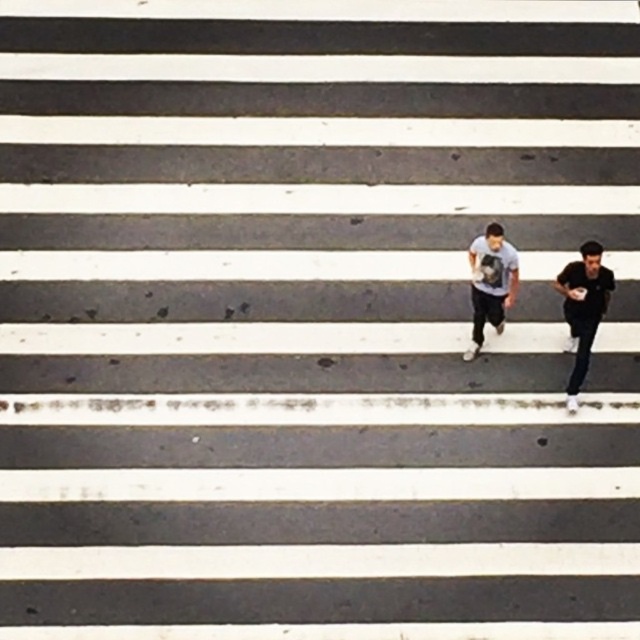
Question: Which object appears closest to the camera in this image?

Choices:
 (A) light blue cotton t-shirt at center
 (B) dark gray fabric pants at right

Answer: (B)

Question: In this image, where is dark gray fabric pants at right located relative to light blue cotton t-shirt at center?

Choices:
 (A) right
 (B) left

Answer: (A)

Question: Is dark gray fabric pants at right below light blue cotton t-shirt at center?

Choices:
 (A) yes
 (B) no

Answer: (A)

Question: Does dark gray fabric pants at right have a larger size compared to light blue cotton t-shirt at center?

Choices:
 (A) yes
 (B) no

Answer: (A)

Question: Which object appears farthest from the camera in this image?

Choices:
 (A) light blue cotton t-shirt at center
 (B) dark gray fabric pants at right

Answer: (A)